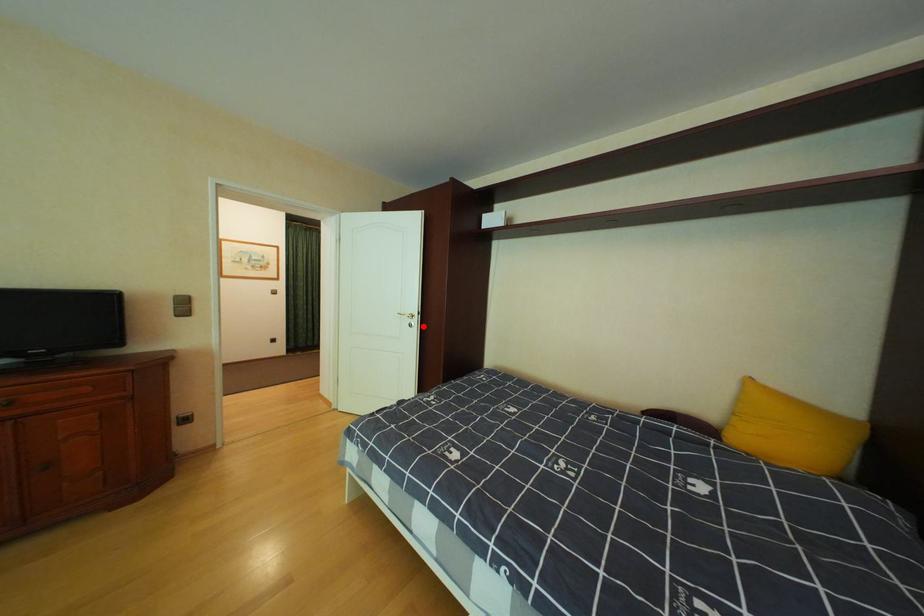
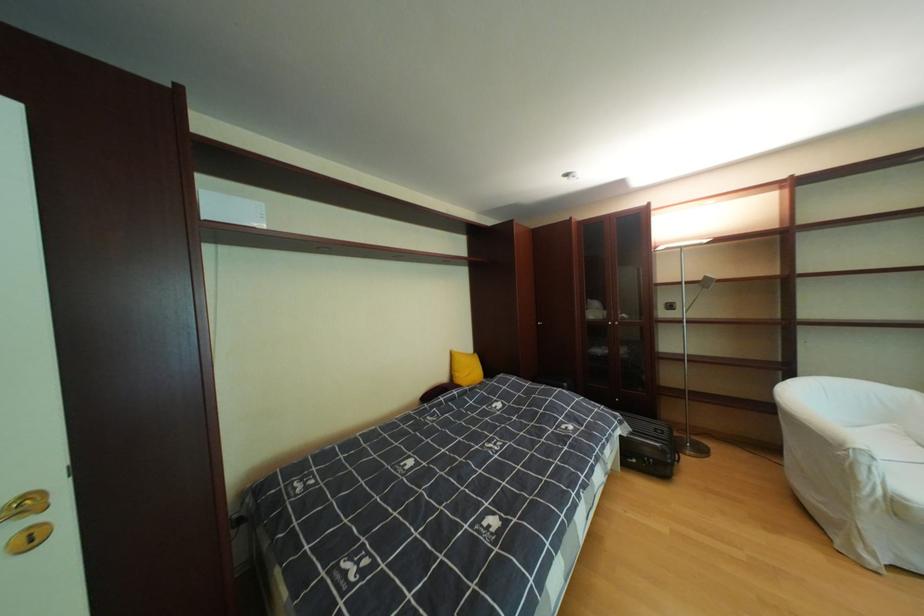
Question: I am providing you with two images of the same scene from different viewpoints. A red point is marked on the first image. Can you still see the location of the red point in image 2?

Choices:
 (A) Yes
 (B) No

Answer: (A)